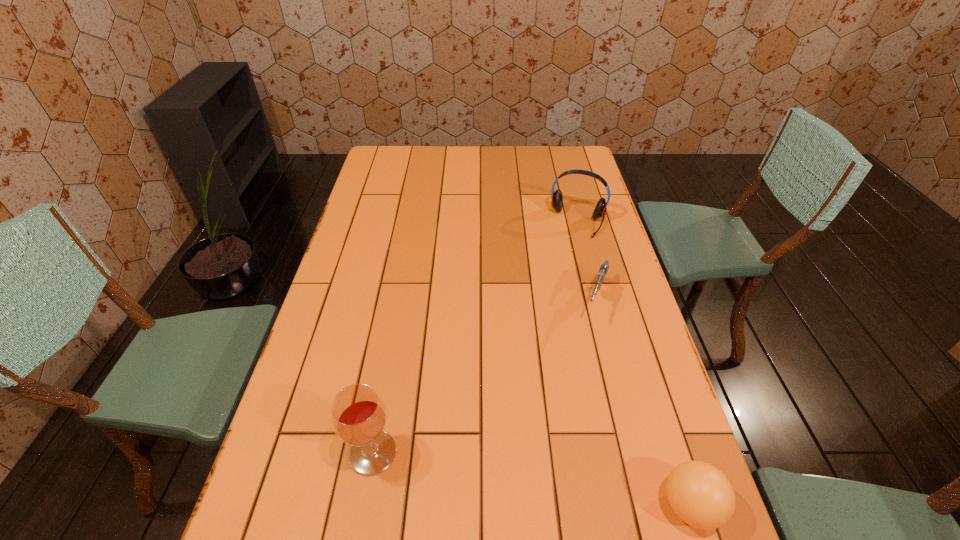
I want to click on vacant spot on the desktop that is between the leftmost object and the ping-pong ball and is positioned with the microphone attached to the side of the headset, so click(x=498, y=474).

This screenshot has height=540, width=960. Find the location of `vacant space on the desktop that is between the wineglass and the ping-pong ball and is positioned at the barrel of the gun`. vacant space on the desktop that is between the wineglass and the ping-pong ball and is positioned at the barrel of the gun is located at coordinates (530, 479).